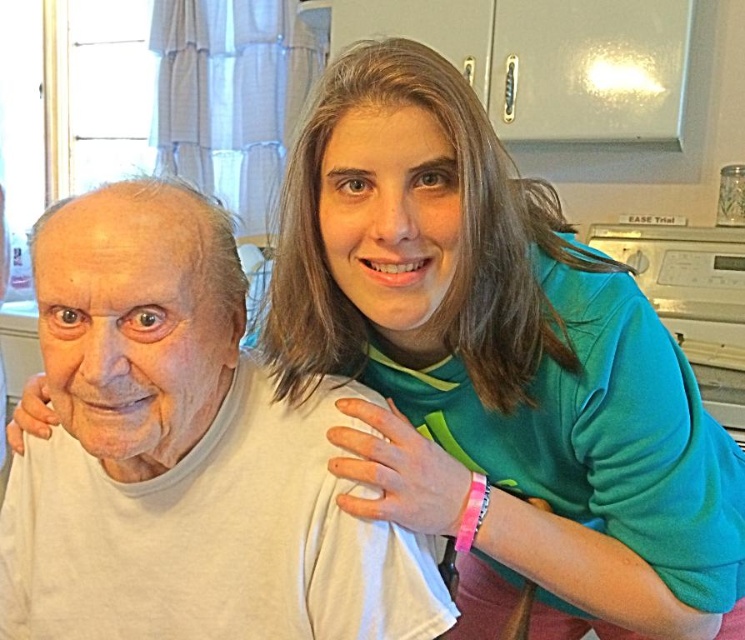
Question: Which point is farther from the camera taking this photo?

Choices:
 (A) (253, 406)
 (B) (714, 524)

Answer: (A)

Question: Can you confirm if teal matte sweatshirt at upper right is bigger than white matte t-shirt at center?

Choices:
 (A) yes
 (B) no

Answer: (A)

Question: Which point appears farthest from the camera in this image?

Choices:
 (A) click(x=685, y=436)
 (B) click(x=183, y=490)

Answer: (B)

Question: Is teal matte sweatshirt at upper right to the left of white matte t-shirt at center from the viewer's perspective?

Choices:
 (A) no
 (B) yes

Answer: (A)

Question: Is teal matte sweatshirt at upper right positioned in front of white matte t-shirt at center?

Choices:
 (A) no
 (B) yes

Answer: (B)